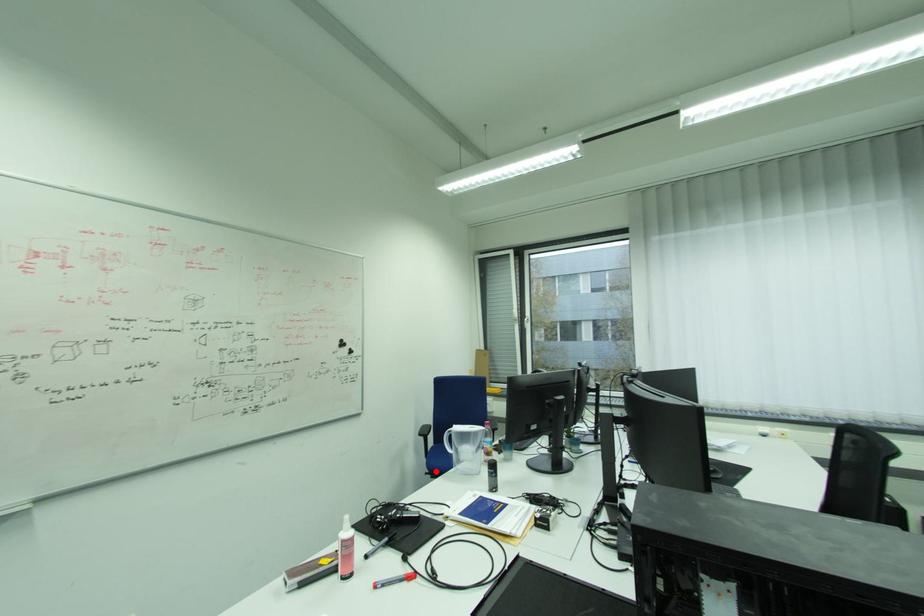
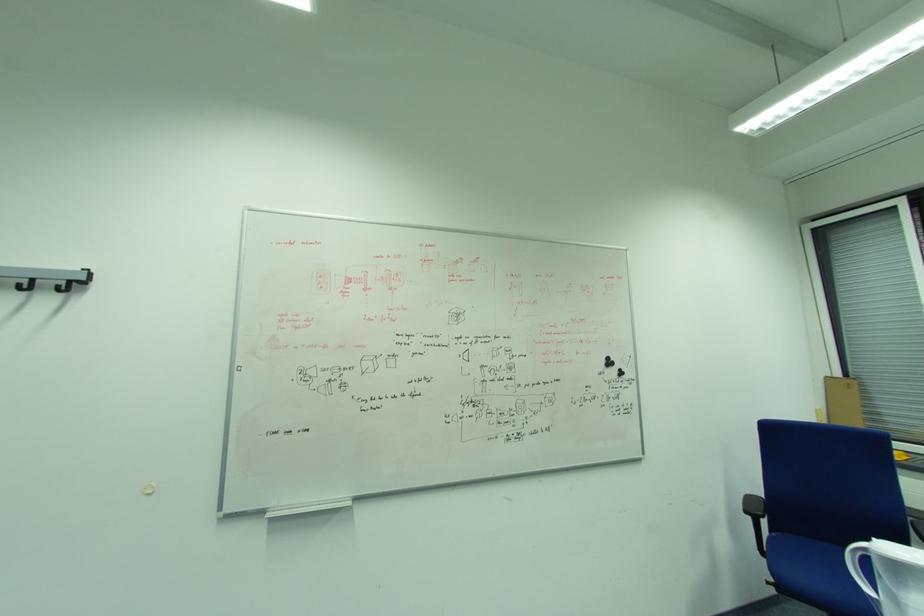
Question: I am providing you with two images of the same scene from different viewpoints. In image1, a red point is highlighted. Considering the same 3D point in image2, which of the following is correct?

Choices:
 (A) It is closer
 (B) It is farther

Answer: (B)